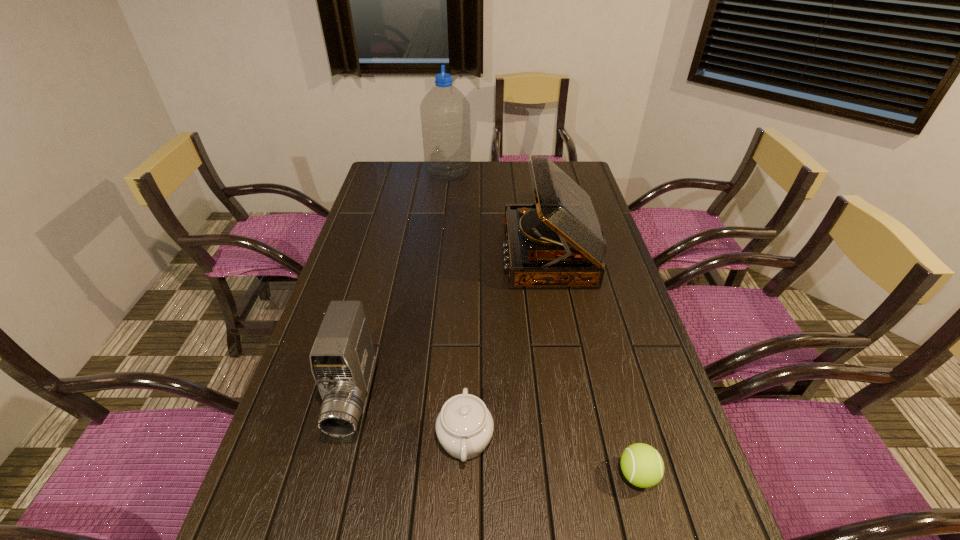
Image resolution: width=960 pixels, height=540 pixels. I want to click on vacant region located on the front-facing side of the record player, so click(472, 253).

Locate an element on the screen. The image size is (960, 540). free space located 0.150m on the front-facing side of the record player is located at coordinates coord(458,253).

Find the location of a particular element. Image resolution: width=960 pixels, height=540 pixels. free region located at the front of the third tallest object, highlighting the lens is located at coordinates (331, 488).

This screenshot has width=960, height=540. In order to click on blank area located on the left of the second shortest object in this screenshot , I will do `click(319, 439)`.

Find the location of `vacant space located on the left of the shortest object`. vacant space located on the left of the shortest object is located at coordinates (438, 475).

At what (x,y) coordinates should I click in order to perform the action: click on object at the far edge. Please return your answer as a coordinate pair (x, y). Looking at the image, I should click on (445, 112).

Image resolution: width=960 pixels, height=540 pixels. I want to click on object that is at the left edge, so click(342, 358).

Find the location of a particular element. record player positioned at the right edge is located at coordinates (558, 242).

Identify the location of tennis ball that is at the right edge. The width and height of the screenshot is (960, 540). (642, 465).

At what (x,y) coordinates should I click in order to perform the action: click on free space at the far edge of the desktop. Please return your answer as a coordinate pair (x, y). Image resolution: width=960 pixels, height=540 pixels. Looking at the image, I should click on (522, 175).